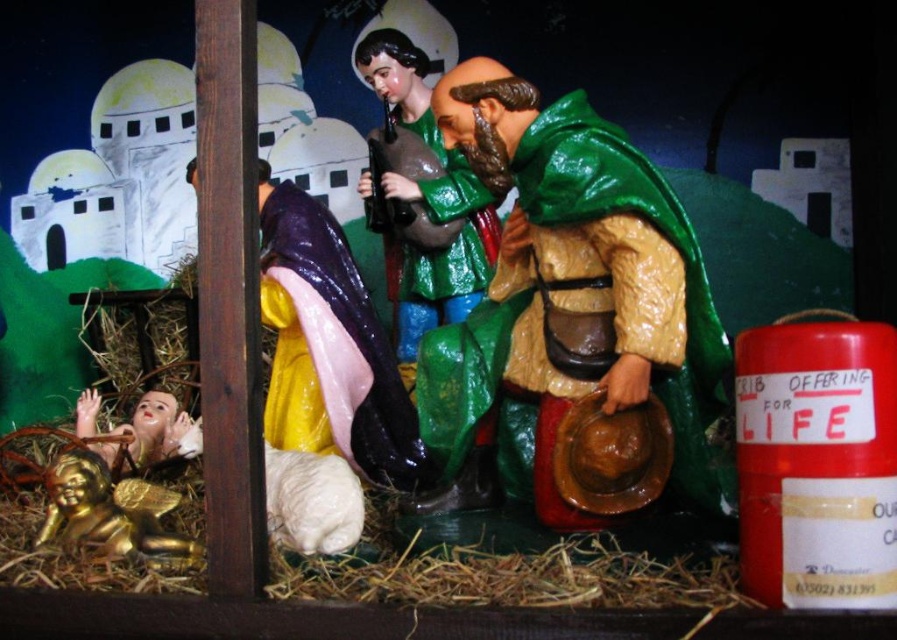
Question: Does green glossy figure at center lie behind gold shiny baby at lower left?

Choices:
 (A) yes
 (B) no

Answer: (B)

Question: Based on their relative distances, which object is farther from the gold shiny angel at lower left?

Choices:
 (A) green glossy figure at center
 (B) gold shiny baby at lower left
 (C) matte green figurine at center
 (D) purple glossy fabric at center

Answer: (C)

Question: Which object appears closest to the camera in this image?

Choices:
 (A) purple glossy fabric at center
 (B) green glossy figure at center

Answer: (B)

Question: Is green glossy figure at center positioned behind gold shiny baby at lower left?

Choices:
 (A) no
 (B) yes

Answer: (A)

Question: Which of the following is the farthest from the observer?

Choices:
 (A) gold shiny angel at lower left
 (B) matte green figurine at center
 (C) green glossy figure at center

Answer: (B)

Question: Is green glossy figure at center bigger than purple glossy fabric at center?

Choices:
 (A) yes
 (B) no

Answer: (A)